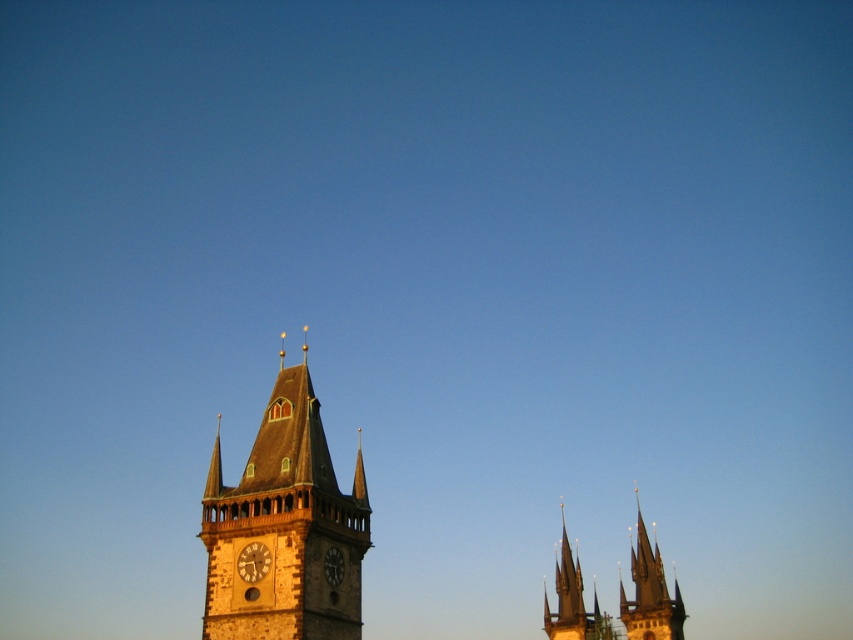
Is point (250, 547) behind point (326, 556)?

No, (250, 547) is in front of (326, 556).

Is point (250, 557) positioned in front of point (334, 550)?

That is True.

What do you see at coordinates (253, 561) in the screenshot?
I see `matte stone clock at center` at bounding box center [253, 561].

At what (x,y) coordinates should I click in order to perform the action: click on matte stone clock at center. Please return your answer as a coordinate pair (x, y). The height and width of the screenshot is (640, 853). Looking at the image, I should click on (253, 561).

Is stone spires at center further to the viewer compared to dark brown stone clock at center?

Yes, stone spires at center is behind dark brown stone clock at center.

Is stone spires at center above dark brown stone clock at center?

No.

Is point (646, 624) positioned behind point (334, 579)?

Yes.

I want to click on stone spires at center, so click(x=648, y=593).

Between point (315, 397) and point (247, 552), which one is positioned in front?

Point (247, 552) is more forward.

Does point (323, 547) come closer to viewer compared to point (254, 560)?

That is False.

Where is `stone clock tower at center`? The height and width of the screenshot is (640, 853). stone clock tower at center is located at coordinates (283, 525).

Where is `stone clock tower at center`? The width and height of the screenshot is (853, 640). stone clock tower at center is located at coordinates (283, 525).